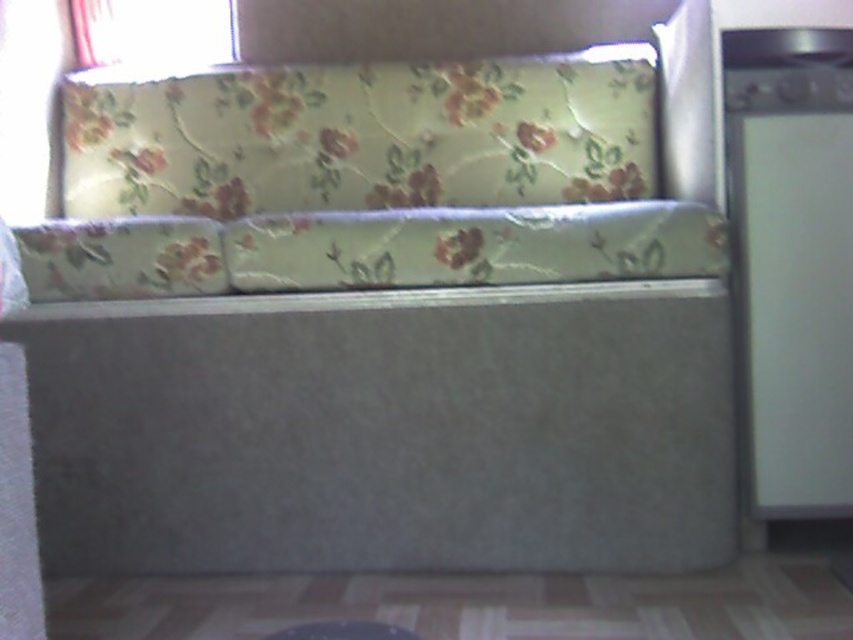
Between white matte refrigerator at right and floral fabric pillow at center, which one has less height?

floral fabric pillow at center

Between white matte refrigerator at right and floral fabric pillow at center, which one appears on the right side from the viewer's perspective?

Positioned to the right is white matte refrigerator at right.

The height and width of the screenshot is (640, 853). I want to click on white matte refrigerator at right, so click(790, 268).

Does floral fabric pillow at center have a larger size compared to white sheer curtain at upper left?

Indeed, floral fabric pillow at center has a larger size compared to white sheer curtain at upper left.

Measure the distance between point (418, 284) and camera.

Point (418, 284) is 1.50 meters away from camera.

The height and width of the screenshot is (640, 853). I want to click on floral fabric pillow at center, so click(473, 246).

Which is more to the left, white matte refrigerator at right or white sheer curtain at upper left?

white sheer curtain at upper left is more to the left.

Between white matte refrigerator at right and white sheer curtain at upper left, which one has more height?

Standing taller between the two is white matte refrigerator at right.

Is point (788, 371) in front of point (161, 26)?

Yes, it is.

Locate an element on the screen. The width and height of the screenshot is (853, 640). white matte refrigerator at right is located at coordinates (790, 268).